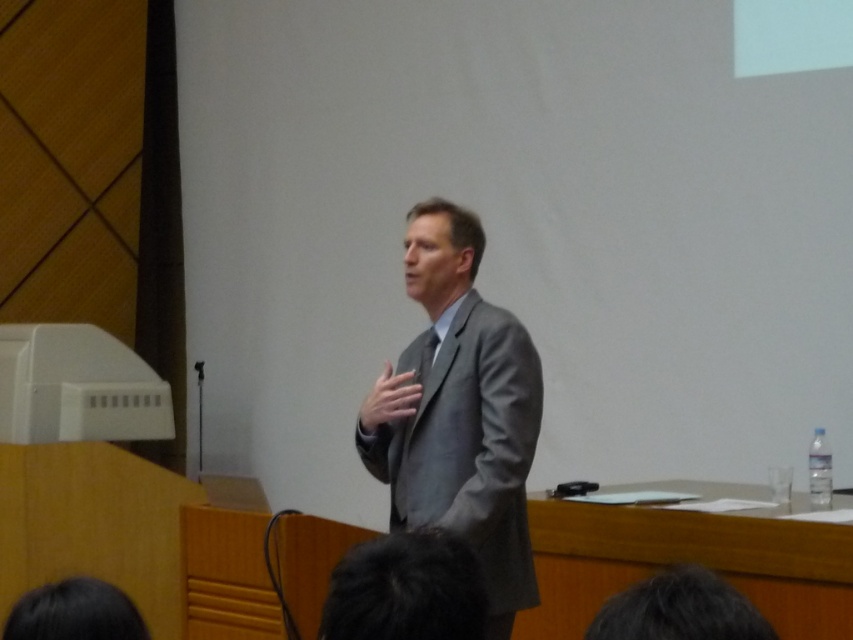
Describe the element at coordinates (459, 412) in the screenshot. I see `gray matte suit at center` at that location.

The image size is (853, 640). Identify the location of gray matte suit at center. (x=459, y=412).

Which of these two, gray matte suit at center or dark brown hair at lower center, stands taller?

With more height is gray matte suit at center.

Can you confirm if gray matte suit at center is smaller than dark brown hair at lower center?

No, gray matte suit at center is not smaller than dark brown hair at lower center.

Does point (401, 509) come behind point (744, 596)?

Yes.

This screenshot has height=640, width=853. Identify the location of gray matte suit at center. (459, 412).

Is dark hair at lower center in front of dark brown hair at lower left?

Yes, it is in front of dark brown hair at lower left.

This screenshot has height=640, width=853. Describe the element at coordinates (405, 589) in the screenshot. I see `dark hair at lower center` at that location.

Is point (433, 632) farther from camera compared to point (13, 621)?

No, (433, 632) is in front of (13, 621).

Locate an element on the screen. The image size is (853, 640). dark hair at lower center is located at coordinates (405, 589).